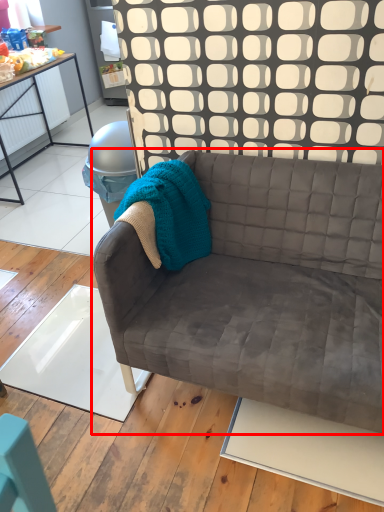
Question: From the image's perspective, considering the relative positions of studio couch (annotated by the red box) and blanket in the image provided, where is studio couch (annotated by the red box) located with respect to the staircase?

Choices:
 (A) above
 (B) below

Answer: (B)